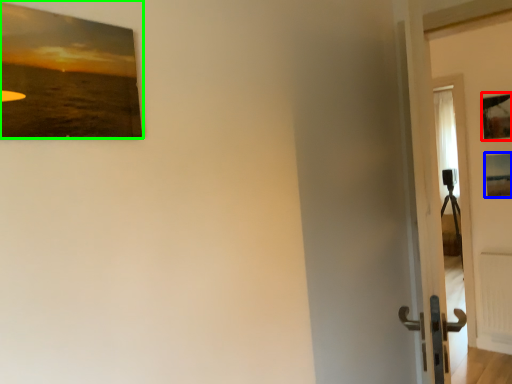
Question: Estimate the real-world distances between objects in this image. Which object is closer to picture frame (highlighted by a red box), picture frame (highlighted by a blue box) or picture frame (highlighted by a green box)?

Choices:
 (A) picture frame
 (B) picture frame

Answer: (A)